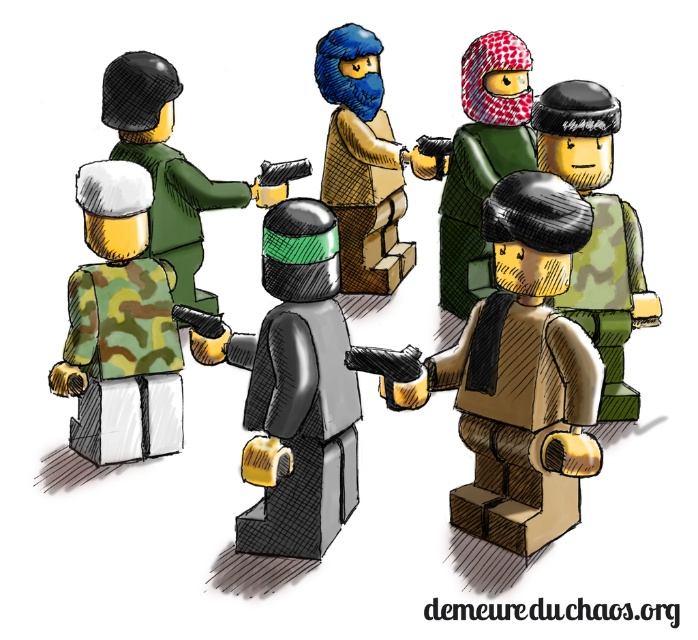
You are a figure in the standoff and need to decide which object to grab first. The matte black helmet at center and the patterned fabric mask at center are both in reach. Which one is closer to the ground?

The matte black helmet at center is shorter than the patterned fabric mask at center, so the matte black helmet at center is closer to the ground.